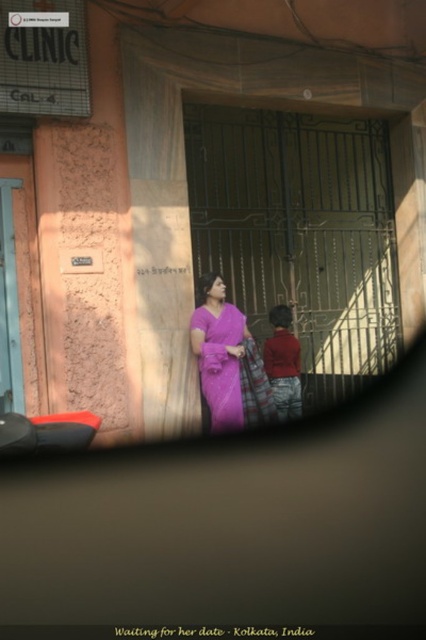
You are a fashion designer observing a street scene in Kolkata. You notice the purple silk saree at center and the red cotton robe at center. Which clothing item is covering the other?

The purple silk saree at center is positioned over the red cotton robe at center, so it is covering the red cotton robe at center.

You are standing in the street scene in Kolkata and want to place a small sticker on the point closer to you between point [224,426] and point [276,387]. Which point should you choose?

Point [224,426] is closer to the viewer than point [276,387], so you should place the sticker on point [224,426].

You are a photographer trying to capture a candid shot of the purple silk saree at center and the red cotton robe at center. Since the image was taken through a reflective surface, you need to adjust your position to avoid glare. Which object should you move closer to first to ensure both are in focus?

The purple silk saree at center is in front of the red cotton robe at center, so you should move closer to the purple silk saree at center first to ensure both are in focus.